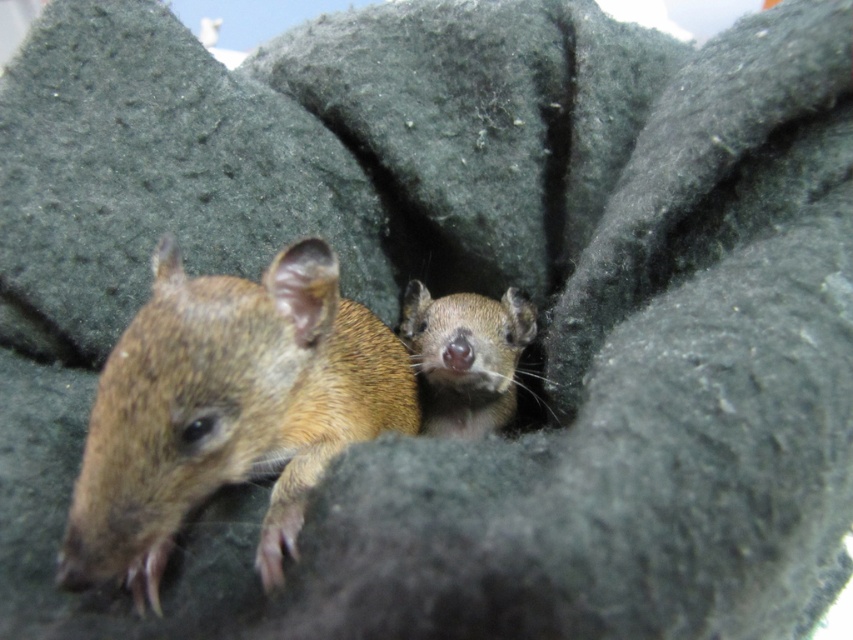
From the picture: You are a small toy mouse trying to play with both the brown fuzzy mouse at left and the fuzzy brown mouse at center. Which mouse should you approach first if you want to play with the bigger one?

You should approach the brown fuzzy mouse at left first because it is larger in size compared to the fuzzy brown mouse at center.

You are observing two mice in a dark, textured environment. The brown fuzzy mouse at left and the fuzzy brown mouse at center are both partially hidden. Which mouse has a greater height?

The brown fuzzy mouse at left is much taller than the fuzzy brown mouse at center.

You are observing two mice in a dark, textured environment. The scene includes a brown fuzzy mouse at left and a fuzzy brown mouse at center. Which mouse is positioned to the left of the other?

The brown fuzzy mouse at left is positioned to the left of the fuzzy brown mouse at center.